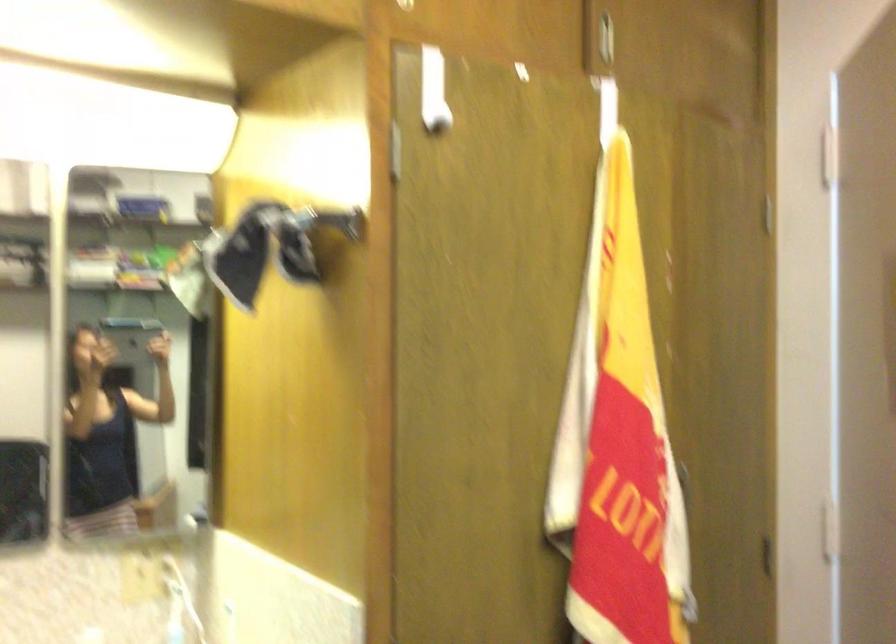
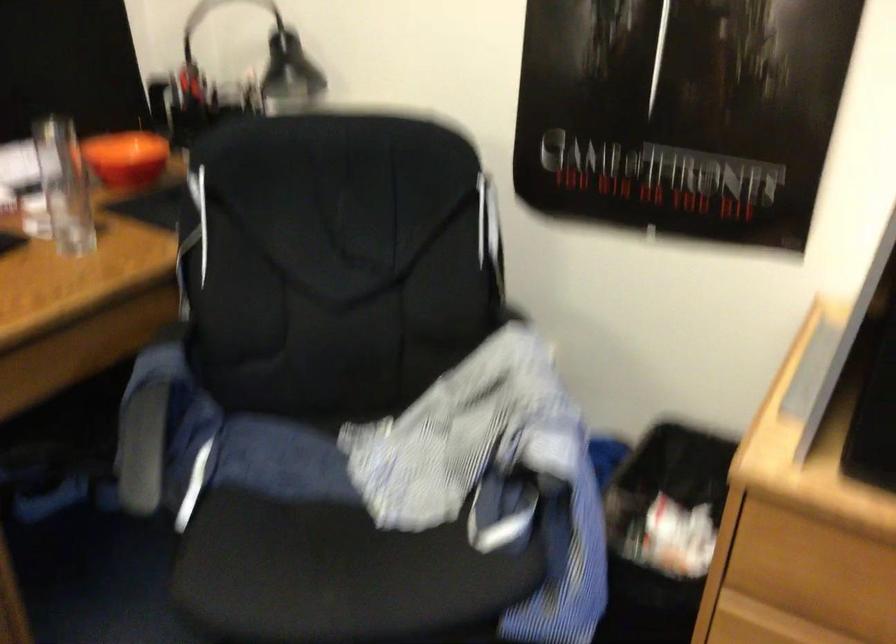
First-person continuous shooting, in which direction is the camera rotating?

The camera rotated toward right-down.